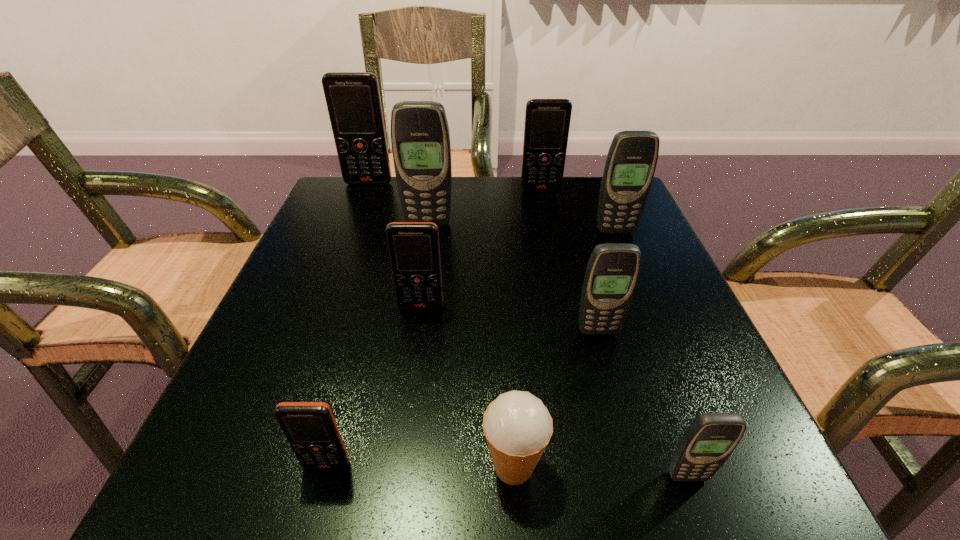
What are the coordinates of `the biggest orange cellular telephone` in the screenshot? It's located at (353, 100).

This screenshot has width=960, height=540. In order to click on the farthest object in this screenshot , I will do tap(353, 100).

At what (x,y) coordinates should I click in order to perform the action: click on the farthest gray cellular telephone. Please return your answer as a coordinate pair (x, y). Looking at the image, I should click on (420, 137).

This screenshot has height=540, width=960. What are the coordinates of `the third farthest cellular telephone` in the screenshot? It's located at (420, 137).

Locate an element on the screen. the second farthest object is located at coordinates (547, 121).

The width and height of the screenshot is (960, 540). I want to click on the second farthest orange cellular telephone, so click(547, 121).

This screenshot has height=540, width=960. I want to click on the third nearest gray cellular telephone, so click(x=631, y=161).

Identify the location of the sixth nearest object. The image size is (960, 540). (631, 161).

Where is `the third biggest gray cellular telephone`? This screenshot has height=540, width=960. the third biggest gray cellular telephone is located at coordinates (612, 272).

The image size is (960, 540). I want to click on the fourth nearest object, so click(x=612, y=272).